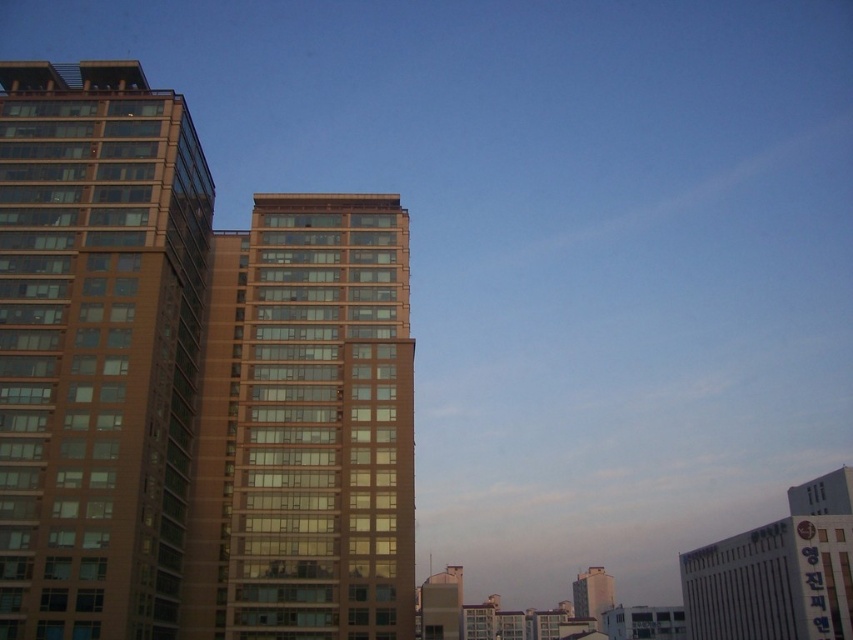
You are an architect evaluating the city layout. You observe the brown glass building at left and the brown glass building at center. Which building has a greater overall size?

The brown glass building at left is larger in size than the brown glass building at center, so the one at left has a greater overall size.

You are a city planner reviewing the city layout. You need to determine which building, the brown glass building at left or the matte brown building at center, requires more space for construction. Based on their sizes, which one would need a larger plot of land?

The matte brown building at center requires a larger plot of land because it is bigger than the brown glass building at left.

You are a drone operator trying to navigate between two points in the city. You have to fly from point A to point B. Given that point A is point (183, 188) and point B is point (277, 435), which point is closer to the main highrise buildings on the left side?

Point (277, 435) is closer to the main highrise buildings on the left side because it is in front of point (183, 188), which is behind it.